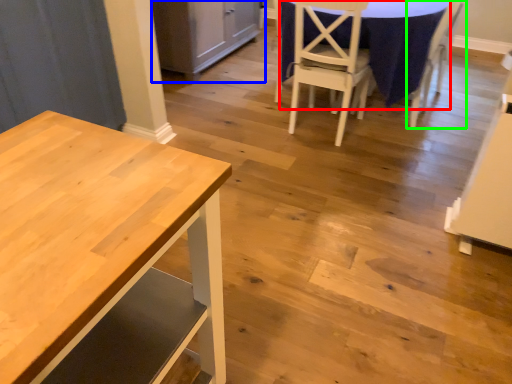
Question: Considering the real-world distances, which object is farthest from tablecloth (highlighted by a red box)? cabinetry (highlighted by a blue box) or chair (highlighted by a green box)?

Choices:
 (A) cabinetry
 (B) chair

Answer: (A)